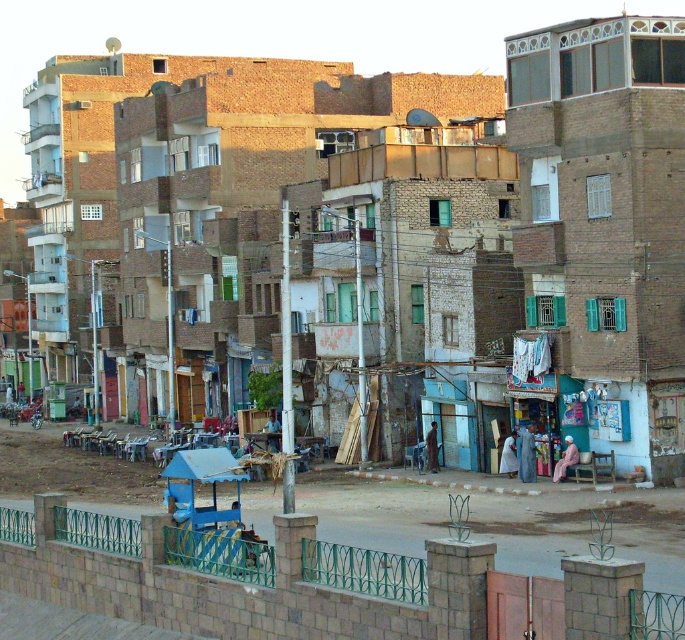
Does point (506, 472) come behind point (274, 410)?

No.

Find the location of `light blue fabric at center`. light blue fabric at center is located at coordinates (508, 456).

Between point (514, 472) and point (275, 420), which one is positioned behind?

Point (275, 420)

Identify the location of light blue fabric at center. (508, 456).

Is point (534, 442) closer to viewer compared to point (564, 468)?

No, (534, 442) is further to viewer.

Is blue fabric dress at lower center positioned before pink fabric at lower center?

No.

I want to click on blue fabric dress at lower center, so click(527, 454).

Is point (562, 460) in front of point (432, 442)?

Yes, it is in front of point (432, 442).

Is pink fabric at lower center in front of dark blue fabric at center?

Yes, pink fabric at lower center is closer to the viewer.

Find the location of a particular element. This screenshot has width=685, height=640. pink fabric at lower center is located at coordinates (564, 460).